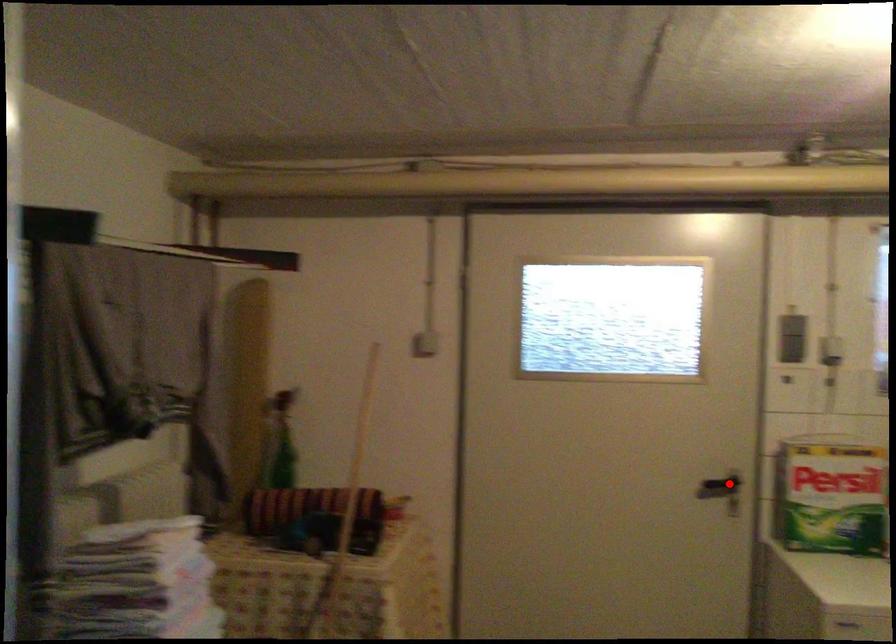
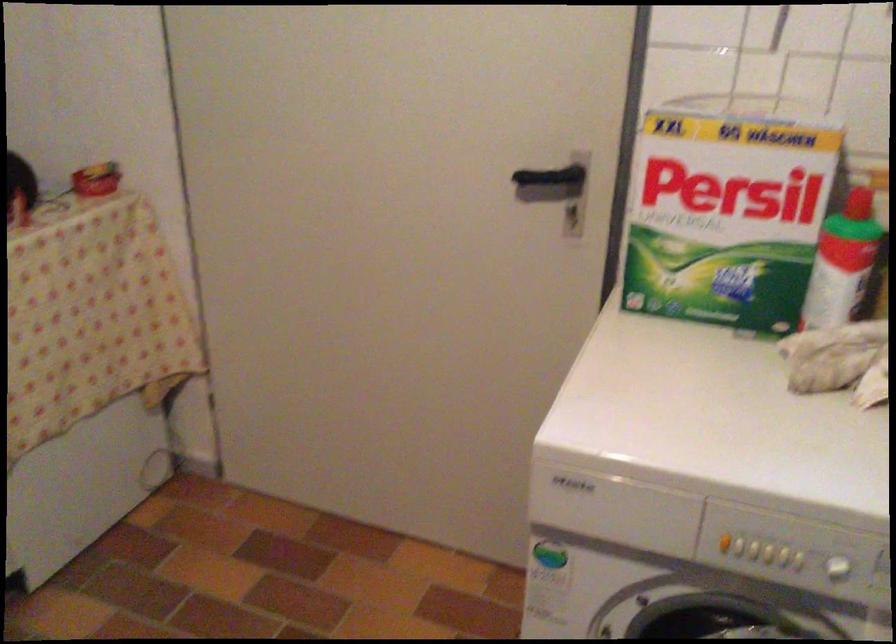
Find the pixel in the second image that matches the highlighted location in the first image.

(553, 180)